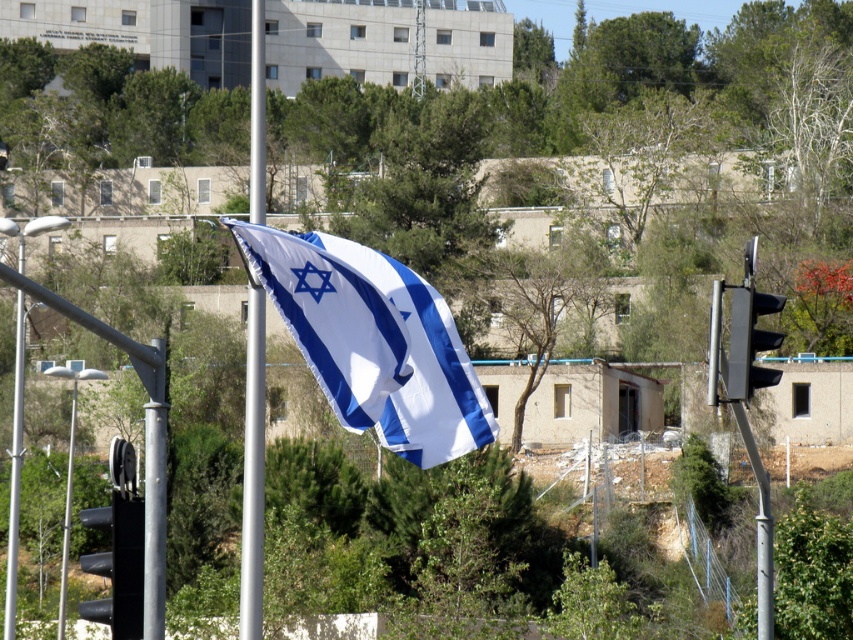
Consider the image. You are standing in the scene and want to walk from point A to point B. Point A is at coordinates point (x=244, y=588) and point B is at coordinates point (x=64, y=582). According to the image, which point is closer to you?

Point (x=244, y=588) is in front of point (x=64, y=582), so point A is closer to you.

You are standing in front of the scene and want to take a photo of the white and blue fabric flag at center and the metallic silver streetlight at left. Which object will appear larger in your photo?

The white and blue fabric flag at center will appear larger in your photo because it is closer to the viewer than the metallic silver streetlight at left.